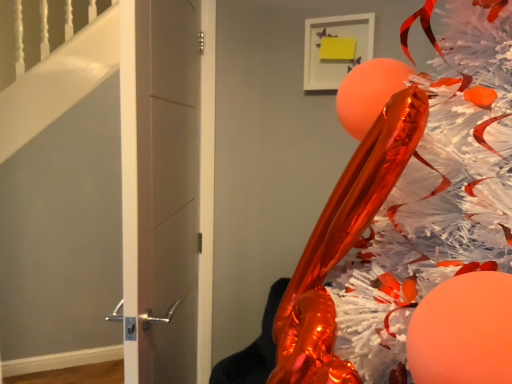
Question: Is matte gray door at center bigger than shiny metallic christmas tree at right?

Choices:
 (A) no
 (B) yes

Answer: (A)

Question: Is matte gray door at center at the right side of shiny metallic christmas tree at right?

Choices:
 (A) no
 (B) yes

Answer: (A)

Question: Does matte gray door at center have a lesser height compared to shiny metallic christmas tree at right?

Choices:
 (A) no
 (B) yes

Answer: (A)

Question: Is matte gray door at center facing away from shiny metallic christmas tree at right?

Choices:
 (A) yes
 (B) no

Answer: (B)

Question: Is matte gray door at center not inside shiny metallic christmas tree at right?

Choices:
 (A) yes
 (B) no

Answer: (A)

Question: Could you tell me if matte gray door at center is facing shiny metallic christmas tree at right?

Choices:
 (A) no
 (B) yes

Answer: (A)

Question: Can you confirm if shiny metallic christmas tree at right is positioned to the left of matte gray door at center?

Choices:
 (A) no
 (B) yes

Answer: (A)

Question: Is shiny metallic christmas tree at right positioned with its back to matte gray door at center?

Choices:
 (A) yes
 (B) no

Answer: (B)

Question: Can you confirm if shiny metallic christmas tree at right is taller than matte gray door at center?

Choices:
 (A) yes
 (B) no

Answer: (B)

Question: From the image's perspective, is shiny metallic christmas tree at right beneath matte gray door at center?

Choices:
 (A) yes
 (B) no

Answer: (A)

Question: Is shiny metallic christmas tree at right not within matte gray door at center?

Choices:
 (A) yes
 (B) no

Answer: (A)

Question: From the image's perspective, does shiny metallic christmas tree at right appear higher than matte gray door at center?

Choices:
 (A) yes
 (B) no

Answer: (B)

Question: Is point (507, 94) positioned closer to the camera than point (188, 125)?

Choices:
 (A) closer
 (B) farther

Answer: (A)